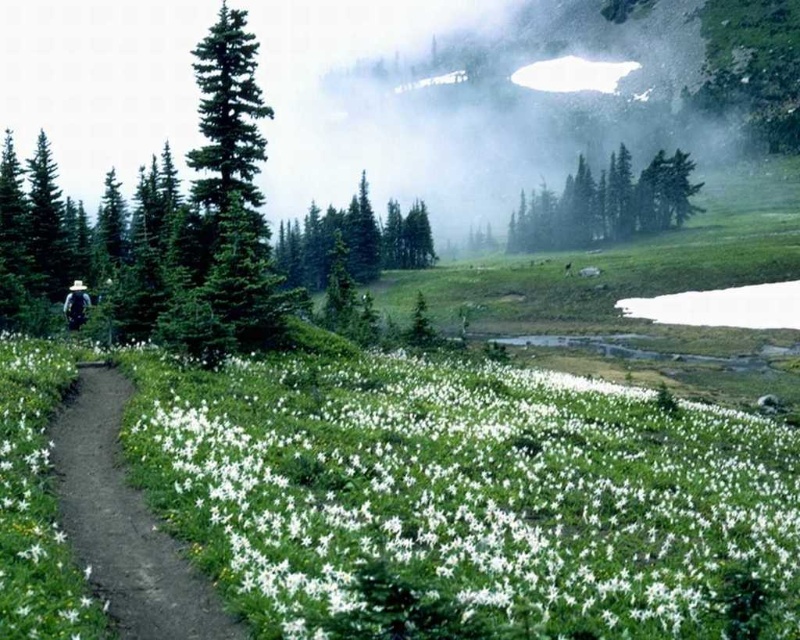
Find the location of a particular element. This screenshot has height=640, width=800. white matte flower at lower center is located at coordinates (470, 497).

Is white matte flower at lower center taller than green matte tree at center?

In fact, white matte flower at lower center may be shorter than green matte tree at center.

Which is in front, point (564, 595) or point (398, 250)?

Point (564, 595)

You are a GUI agent. You are given a task and a screenshot of the screen. Output one action in this format:
    pyautogui.click(x=<x>, y=<y>)
    Task: Click on the white matte flower at lower center
    
    Given the screenshot: What is the action you would take?
    pyautogui.click(x=470, y=497)

Which of these two, dirt path at left or green matte trees at upper center, stands shorter?

dirt path at left

Does dirt path at left have a greater width compared to green matte trees at upper center?

No, dirt path at left is not wider than green matte trees at upper center.

What do you see at coordinates (126, 524) in the screenshot? This screenshot has height=640, width=800. I see `dirt path at left` at bounding box center [126, 524].

Find the location of a particular element. dirt path at left is located at coordinates (126, 524).

Which of these two, green matte trees at upper center or green matte tree at center, stands shorter?

With less height is green matte trees at upper center.

Does green matte trees at upper center appear under green matte tree at center?

No.

Who is more forward, [682,198] or [306,225]?

Point [682,198] is in front.

Find the location of a particular element. green matte trees at upper center is located at coordinates (605, 204).